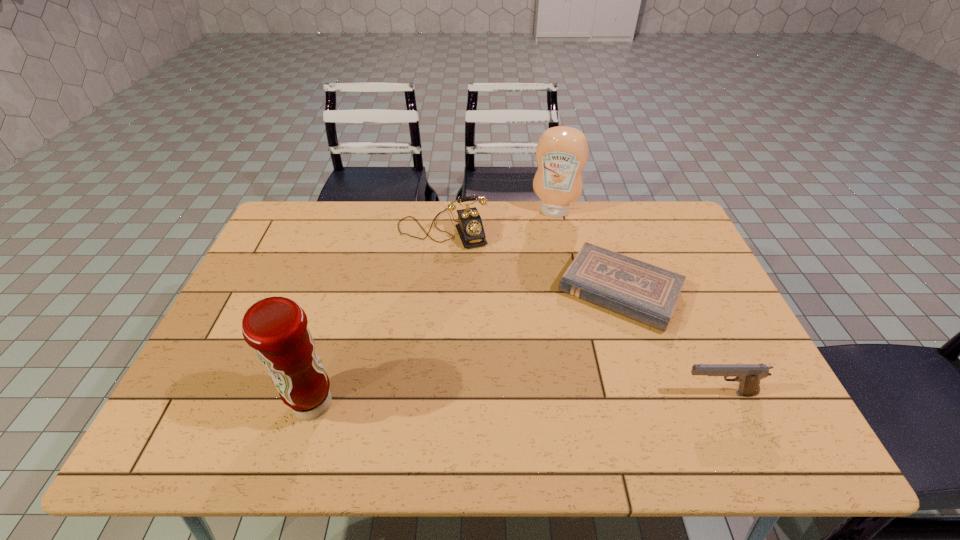
In order to click on vacant spot on the desktop that is between the nearer condiment and the pistol and is positioned on the label of the farther condiment in this screenshot , I will do `click(503, 399)`.

Where is `vacant space on the desktop that is between the left condiment and the pistol and is positioned on the dial of the second object from left to right`? This screenshot has height=540, width=960. vacant space on the desktop that is between the left condiment and the pistol and is positioned on the dial of the second object from left to right is located at coordinates (504, 399).

This screenshot has height=540, width=960. I want to click on free spot on the desktop that is between the nearer condiment and the second shortest object and is positioned on the spine side of the Bible, so click(x=565, y=397).